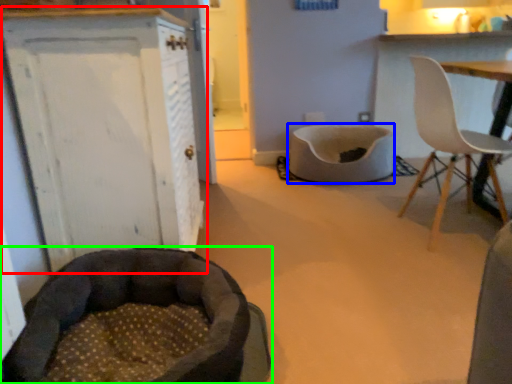
Question: Considering the real-world distances, which object is farthest from cabinetry (highlighted by a red box)? cat bed (highlighted by a blue box) or dog bed (highlighted by a green box)?

Choices:
 (A) cat bed
 (B) dog bed

Answer: (A)